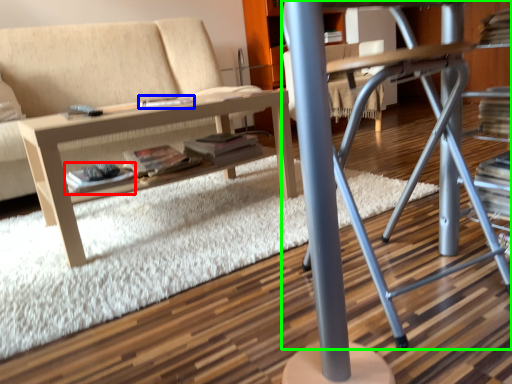
Question: Considering the real-world distances, which object is closest to paperback book (highlighted by a red box)? magazine (highlighted by a blue box) or computer desk (highlighted by a green box).

Choices:
 (A) magazine
 (B) computer desk

Answer: (A)